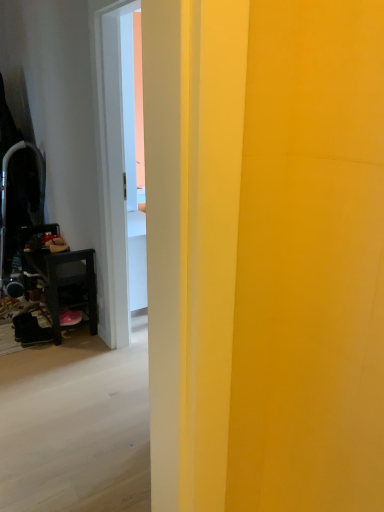
Identify the location of wooden dark brown table at left. (66, 281).

Image resolution: width=384 pixels, height=512 pixels. What do you see at coordinates (66, 281) in the screenshot?
I see `wooden dark brown table at left` at bounding box center [66, 281].

Describe the element at coordinates (70, 317) in the screenshot. I see `pink suede shoe at lower left, which is counted as the first footwear, starting from the right` at that location.

I want to click on metallic black swivel chair at left, so click(x=6, y=191).

The width and height of the screenshot is (384, 512). What do you see at coordinates (6, 191) in the screenshot? I see `metallic black swivel chair at left` at bounding box center [6, 191].

I want to click on black suede boot at lower left, which is the second footwear in right-to-left order, so click(31, 330).

This screenshot has height=512, width=384. In order to click on wooden dark brown table at left in this screenshot , I will do `click(66, 281)`.

Between metallic black swivel chair at left and pink suede shoe at lower left, the 2th footwear from the left, which one has more height?

With more height is metallic black swivel chair at left.

Is pink suede shoe at lower left, which is counted as the first footwear, starting from the right, a part of metallic black swivel chair at left?

No, pink suede shoe at lower left, which is counted as the first footwear, starting from the right, is not inside metallic black swivel chair at left.

Where is `swivel chair above the pink suede shoe at lower left, the 2th footwear from the left (from a real-world perspective)`? The height and width of the screenshot is (512, 384). swivel chair above the pink suede shoe at lower left, the 2th footwear from the left (from a real-world perspective) is located at coordinates (6, 191).

From the image's perspective, is metallic black swivel chair at left beneath pink suede shoe at lower left, which is counted as the first footwear, starting from the right?

Incorrect, from the image's perspective, metallic black swivel chair at left is higher than pink suede shoe at lower left, which is counted as the first footwear, starting from the right.

Between black suede boot at lower left, the 1th footwear from the left, and metallic black swivel chair at left, which one has smaller size?

Smaller between the two is black suede boot at lower left, the 1th footwear from the left.

From the metallic black swivel chair at left, count 1st footwear to the right and point to it. Please provide its 2D coordinates.

[(31, 330)]

Does black suede boot at lower left, which is the second footwear in right-to-left order, turn towards metallic black swivel chair at left?

No, black suede boot at lower left, which is the second footwear in right-to-left order, is not turned towards metallic black swivel chair at left.

Is black suede boot at lower left, which is the second footwear in right-to-left order, to the right of metallic black swivel chair at left from the viewer's perspective?

Correct, you'll find black suede boot at lower left, which is the second footwear in right-to-left order, to the right of metallic black swivel chair at left.

Identify the location of furniture above the black suede boot at lower left, which is the second footwear in right-to-left order (from a real-world perspective). Image resolution: width=384 pixels, height=512 pixels. (66, 281).

Is wooden dark brown table at left next to black suede boot at lower left, which is the second footwear in right-to-left order?

wooden dark brown table at left and black suede boot at lower left, which is the second footwear in right-to-left order, are not in contact.

Considering the relative sizes of wooden dark brown table at left and black suede boot at lower left, the 1th footwear from the left, in the image provided, is wooden dark brown table at left bigger than black suede boot at lower left, the 1th footwear from the left,?

Indeed, wooden dark brown table at left has a larger size compared to black suede boot at lower left, the 1th footwear from the left.

Between wooden dark brown table at left and black suede boot at lower left, which is the second footwear in right-to-left order, which one is positioned behind?

black suede boot at lower left, which is the second footwear in right-to-left order, is further away from the camera.

This screenshot has width=384, height=512. Find the location of `furniture below the metallic black swivel chair at left (from the image's perspective)`. furniture below the metallic black swivel chair at left (from the image's perspective) is located at coordinates tap(66, 281).

From a real-world perspective, between metallic black swivel chair at left and wooden dark brown table at left, who is vertically lower?

wooden dark brown table at left is physically lower.

Does metallic black swivel chair at left come in front of wooden dark brown table at left?

No, it is not.

Considering the relative positions of metallic black swivel chair at left and wooden dark brown table at left in the image provided, is metallic black swivel chair at left to the left of wooden dark brown table at left from the viewer's perspective?

Yes.

You are a GUI agent. You are given a task and a screenshot of the screen. Output one action in this format:
    pyautogui.click(x=<x>, y=<y>)
    Task: Click on the swivel chair lying above the pink suede shoe at lower left, the 2th footwear from the left (from the image's perspective)
    The height and width of the screenshot is (512, 384).
    Given the screenshot: What is the action you would take?
    pyautogui.click(x=6, y=191)

Are pink suede shoe at lower left, the 2th footwear from the left, and metallic black swivel chair at left making contact?

No, pink suede shoe at lower left, the 2th footwear from the left, is not making contact with metallic black swivel chair at left.

Between pink suede shoe at lower left, which is counted as the first footwear, starting from the right, and metallic black swivel chair at left, which one has larger size?

metallic black swivel chair at left is bigger.

Considering the sizes of objects pink suede shoe at lower left, the 2th footwear from the left, and metallic black swivel chair at left in the image provided, who is wider, pink suede shoe at lower left, the 2th footwear from the left, or metallic black swivel chair at left?

With larger width is metallic black swivel chair at left.

Is pink suede shoe at lower left, which is counted as the first footwear, starting from the right, situated inside wooden dark brown table at left or outside?

pink suede shoe at lower left, which is counted as the first footwear, starting from the right, is contained in wooden dark brown table at left.

How different are the orientations of pink suede shoe at lower left, the 2th footwear from the left, and wooden dark brown table at left in degrees?

There is a 4.55-degree angle between the facing directions of pink suede shoe at lower left, the 2th footwear from the left, and wooden dark brown table at left.

From a real-world perspective, which is physically above, pink suede shoe at lower left, the 2th footwear from the left, or wooden dark brown table at left?

wooden dark brown table at left is physically above.

Consider the image. Is the depth of black suede boot at lower left, the 1th footwear from the left, less than that of pink suede shoe at lower left, which is counted as the first footwear, starting from the right?

Yes, it is in front of pink suede shoe at lower left, which is counted as the first footwear, starting from the right.

Considering the relative positions of black suede boot at lower left, which is the second footwear in right-to-left order, and pink suede shoe at lower left, which is counted as the first footwear, starting from the right, in the image provided, is black suede boot at lower left, which is the second footwear in right-to-left order, to the left of pink suede shoe at lower left, which is counted as the first footwear, starting from the right, from the viewer's perspective?

Yes.

Choose the correct answer: Is black suede boot at lower left, which is the second footwear in right-to-left order, inside pink suede shoe at lower left, which is counted as the first footwear, starting from the right, or outside it?

black suede boot at lower left, which is the second footwear in right-to-left order, is located beyond the bounds of pink suede shoe at lower left, which is counted as the first footwear, starting from the right.

In terms of height, does black suede boot at lower left, the 1th footwear from the left, look taller or shorter compared to pink suede shoe at lower left, the 2th footwear from the left?

Considering their sizes, black suede boot at lower left, the 1th footwear from the left, has more height than pink suede shoe at lower left, the 2th footwear from the left.

From the image's perspective, starting from the metallic black swivel chair at left, which footwear is the 1st one below? Please provide its 2D coordinates.

[(70, 317)]

What are the coordinates of `footwear that is the 1st one when counting rightward from the metallic black swivel chair at left` in the screenshot? It's located at (31, 330).

Based on their spatial positions, is metallic black swivel chair at left or black suede boot at lower left, the 1th footwear from the left, closer to wooden dark brown table at left?

Among the two, black suede boot at lower left, the 1th footwear from the left, is located nearer to wooden dark brown table at left.

From the image, which object appears to be nearer to metallic black swivel chair at left, wooden dark brown table at left or black suede boot at lower left, which is the second footwear in right-to-left order?

wooden dark brown table at left is positioned closer to the anchor metallic black swivel chair at left.

When comparing their distances from pink suede shoe at lower left, the 2th footwear from the left, does black suede boot at lower left, which is the second footwear in right-to-left order, or wooden dark brown table at left seem closer?

Among the two, black suede boot at lower left, which is the second footwear in right-to-left order, is located nearer to pink suede shoe at lower left, the 2th footwear from the left.

Estimate the real-world distances between objects in this image. Which object is further from black suede boot at lower left, which is the second footwear in right-to-left order, wooden dark brown table at left or metallic black swivel chair at left?

metallic black swivel chair at left lies further to black suede boot at lower left, which is the second footwear in right-to-left order, than the other object.

Estimate the real-world distances between objects in this image. Which object is further from pink suede shoe at lower left, which is counted as the first footwear, starting from the right, wooden dark brown table at left or black suede boot at lower left, the 1th footwear from the left?

wooden dark brown table at left lies further to pink suede shoe at lower left, which is counted as the first footwear, starting from the right, than the other object.

Considering their positions, is black suede boot at lower left, which is the second footwear in right-to-left order, positioned closer to wooden dark brown table at left than pink suede shoe at lower left, which is counted as the first footwear, starting from the right?

Among the two, pink suede shoe at lower left, which is counted as the first footwear, starting from the right, is located nearer to wooden dark brown table at left.

Considering their positions, is wooden dark brown table at left positioned further to black suede boot at lower left, which is the second footwear in right-to-left order, than pink suede shoe at lower left, which is counted as the first footwear, starting from the right?

wooden dark brown table at left is further to black suede boot at lower left, which is the second footwear in right-to-left order.

In the scene shown: Estimate the real-world distances between objects in this image. Which object is further from pink suede shoe at lower left, the 2th footwear from the left, metallic black swivel chair at left or wooden dark brown table at left?

The object further to pink suede shoe at lower left, the 2th footwear from the left, is metallic black swivel chair at left.

Where is `footwear that lies between wooden dark brown table at left and black suede boot at lower left, the 1th footwear from the left, from top to bottom`? This screenshot has height=512, width=384. footwear that lies between wooden dark brown table at left and black suede boot at lower left, the 1th footwear from the left, from top to bottom is located at coordinates (70, 317).

This screenshot has width=384, height=512. Find the location of `furniture between metallic black swivel chair at left and pink suede shoe at lower left, the 2th footwear from the left, in the vertical direction`. furniture between metallic black swivel chair at left and pink suede shoe at lower left, the 2th footwear from the left, in the vertical direction is located at coordinates (66, 281).

In order to click on furniture between metallic black swivel chair at left and black suede boot at lower left, which is the second footwear in right-to-left order, in the vertical direction in this screenshot , I will do `click(66, 281)`.

Find the location of a particular element. This screenshot has width=384, height=512. footwear between metallic black swivel chair at left and black suede boot at lower left, which is the second footwear in right-to-left order, in the up-down direction is located at coordinates [x=70, y=317].